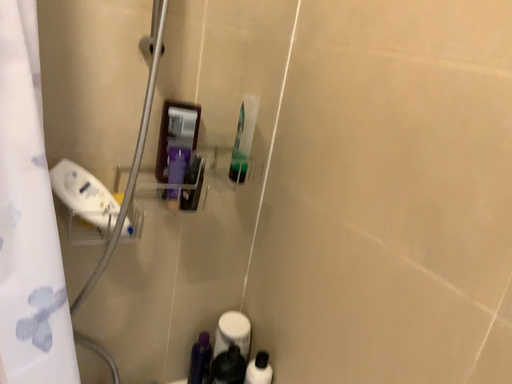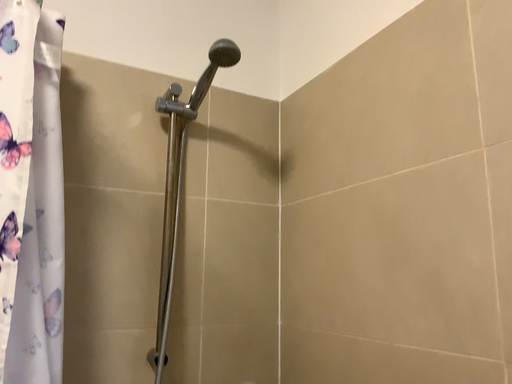
Question: Which way did the camera rotate in the video?

Choices:
 (A) rotated downward
 (B) rotated upward

Answer: (B)